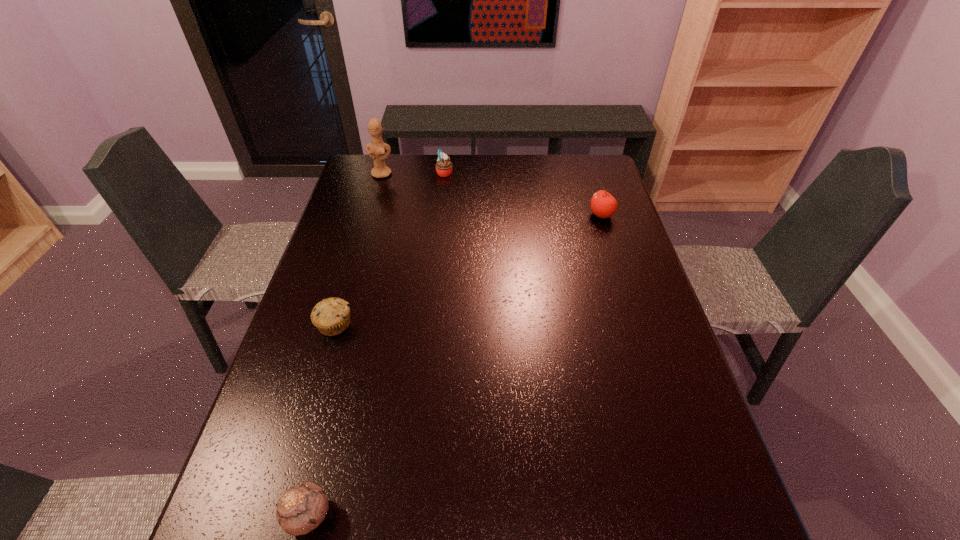
You are a GUI agent. You are given a task and a screenshot of the screen. Output one action in this format:
    pyautogui.click(x=<x>, y=<y>)
    Task: Click on the vacant space that's between the second farthest muffin and the tallest object
    This screenshot has width=960, height=540.
    Given the screenshot: What is the action you would take?
    pyautogui.click(x=358, y=249)

Locate an element on the screen. free spot between the apple and the farthest muffin is located at coordinates (523, 194).

Image resolution: width=960 pixels, height=540 pixels. Identify the location of vacant area that lies between the apple and the second farthest muffin. (468, 269).

Where is `free spot between the second nearest object and the figurine`? The image size is (960, 540). free spot between the second nearest object and the figurine is located at coordinates (358, 249).

This screenshot has width=960, height=540. Find the location of `blank region between the tallest object and the second object from right to left`. blank region between the tallest object and the second object from right to left is located at coordinates (413, 173).

You are a GUI agent. You are given a task and a screenshot of the screen. Output one action in this format:
    pyautogui.click(x=<x>, y=<y>)
    Task: Click on the vacant region between the second farthest muffin and the fourth object from left to right
    The image size is (960, 540).
    Given the screenshot: What is the action you would take?
    pyautogui.click(x=390, y=248)

You are a GUI agent. You are given a task and a screenshot of the screen. Output one action in this format:
    pyautogui.click(x=<x>, y=<y>)
    Task: Click on the vacant area between the second nearest muffin and the rightmost muffin
    Image resolution: width=960 pixels, height=540 pixels.
    Given the screenshot: What is the action you would take?
    pyautogui.click(x=390, y=248)

In order to click on object that is the closest to the second object from right to left in this screenshot , I will do `click(376, 149)`.

Locate an element on the screen. The image size is (960, 540). object identified as the closest to the second nearest muffin is located at coordinates (302, 508).

This screenshot has width=960, height=540. In order to click on muffin that is the nearest to the second nearest object in this screenshot , I will do `click(302, 508)`.